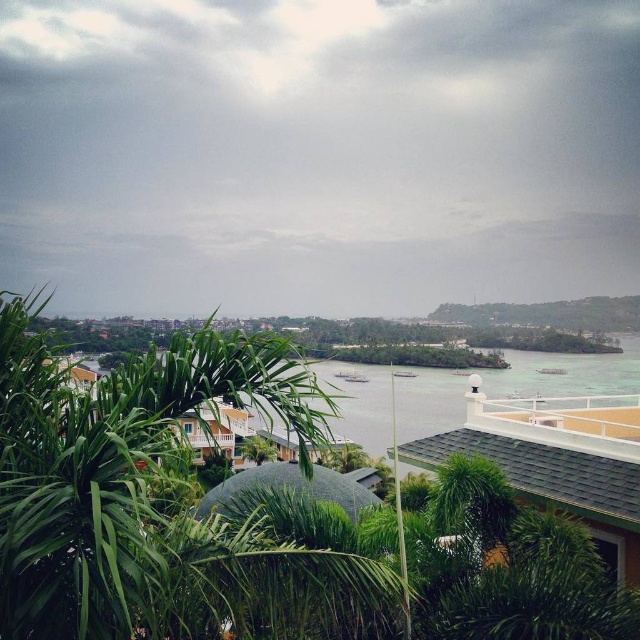
You are a photographer planning to capture the coastal view. You notice the green leafy vegetation at center and the clear water at center. Which object is positioned higher in the scene?

The green leafy vegetation at center is located above the clear water at center, so it is positioned higher in the scene.

You are standing at the top of a hill overlooking the coastal area. You notice the green leafy vegetation at center. Can you determine its exact coordinates in the image?

The green leafy vegetation at center is located at coordinates point (157, 502).